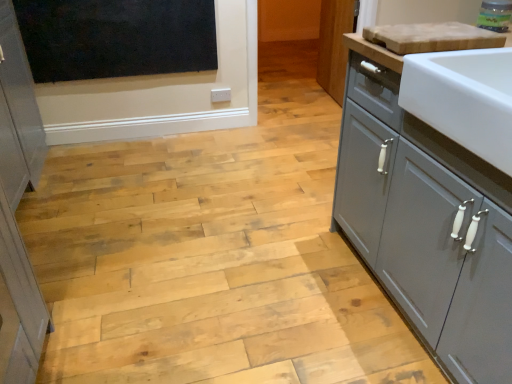
Question: Does black matte window screen at upper left have a lesser width compared to light brown wood cutting board at upper right?

Choices:
 (A) no
 (B) yes

Answer: (B)

Question: Does black matte window screen at upper left have a greater width compared to light brown wood cutting board at upper right?

Choices:
 (A) no
 (B) yes

Answer: (A)

Question: Does black matte window screen at upper left have a greater height compared to light brown wood cutting board at upper right?

Choices:
 (A) no
 (B) yes

Answer: (B)

Question: Is there a large distance between black matte window screen at upper left and light brown wood cutting board at upper right?

Choices:
 (A) no
 (B) yes

Answer: (B)

Question: Are black matte window screen at upper left and light brown wood cutting board at upper right making contact?

Choices:
 (A) yes
 (B) no

Answer: (B)

Question: Considering the positions of light brown wood cutting board at upper right and black matte window screen at upper left in the image, is light brown wood cutting board at upper right wider or thinner than black matte window screen at upper left?

Choices:
 (A) thin
 (B) wide

Answer: (B)

Question: From the image's perspective, relative to black matte window screen at upper left, is light brown wood cutting board at upper right above or below?

Choices:
 (A) below
 (B) above

Answer: (A)

Question: Considering the positions of light brown wood cutting board at upper right and black matte window screen at upper left in the image, is light brown wood cutting board at upper right taller or shorter than black matte window screen at upper left?

Choices:
 (A) short
 (B) tall

Answer: (A)

Question: Is light brown wood cutting board at upper right inside or outside of black matte window screen at upper left?

Choices:
 (A) outside
 (B) inside

Answer: (A)

Question: In terms of width, does black matte window screen at upper left look wider or thinner when compared to translucent glass jar at upper right?

Choices:
 (A) thin
 (B) wide

Answer: (A)

Question: Considering the relative positions of black matte window screen at upper left and translucent glass jar at upper right in the image provided, is black matte window screen at upper left to the left or to the right of translucent glass jar at upper right?

Choices:
 (A) left
 (B) right

Answer: (A)

Question: Considering the positions of black matte window screen at upper left and translucent glass jar at upper right in the image, is black matte window screen at upper left bigger or smaller than translucent glass jar at upper right?

Choices:
 (A) small
 (B) big

Answer: (B)

Question: Considering the positions of point (x=198, y=6) and point (x=497, y=6), is point (x=198, y=6) closer or farther from the camera than point (x=497, y=6)?

Choices:
 (A) closer
 (B) farther

Answer: (B)

Question: In terms of height, does black matte window screen at upper left look taller or shorter compared to matte gray cabinet at right?

Choices:
 (A) short
 (B) tall

Answer: (A)

Question: From a real-world perspective, is black matte window screen at upper left above or below matte gray cabinet at right?

Choices:
 (A) below
 (B) above

Answer: (B)